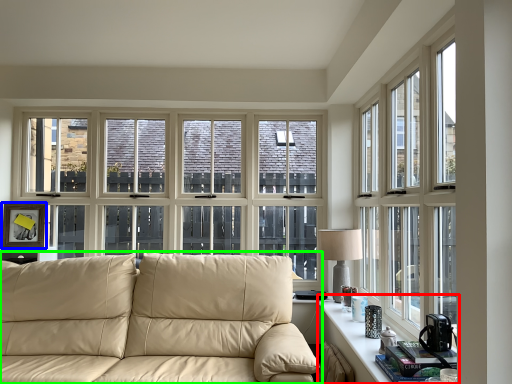
Question: Estimate the real-world distances between objects in this image. Which object is closer to table (highlighted by a red box), picture frame (highlighted by a blue box) or studio couch (highlighted by a green box)?

Choices:
 (A) picture frame
 (B) studio couch

Answer: (B)